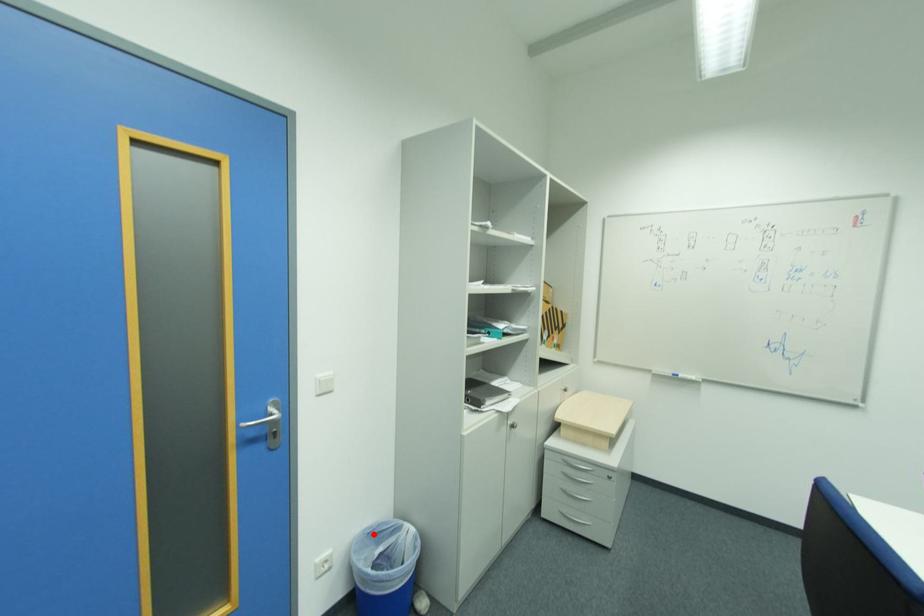
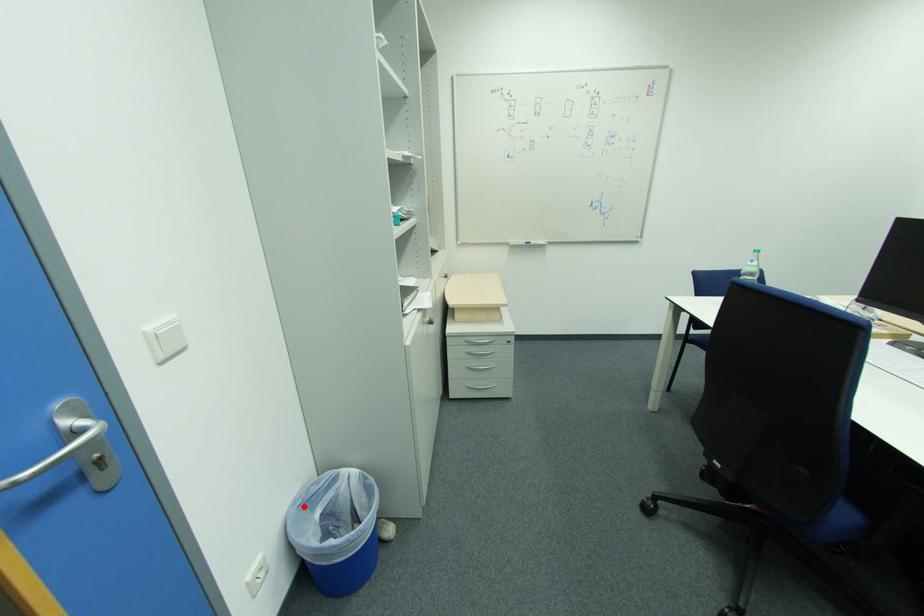
I am providing you with two images of the same scene from different viewpoints. A red point is marked on the first image and another point is marked on the second image. Do the highlighted points in image1 and image2 indicate the same real-world spot?

Yes